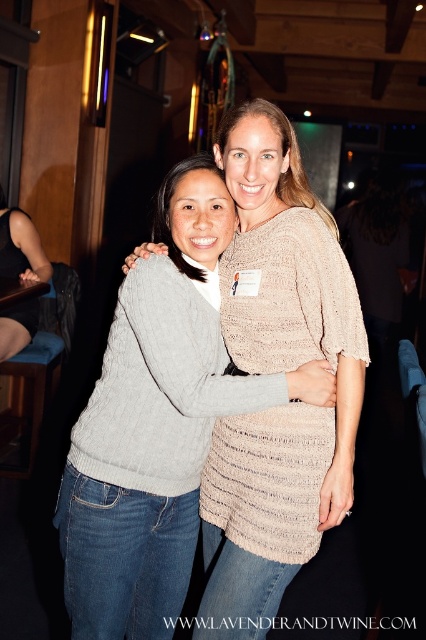
Question: Which of the following is the farthest from the observer?

Choices:
 (A) (20, 209)
 (B) (60, 529)

Answer: (A)

Question: Can you confirm if gray knitted sweater at center is positioned above matte gray sweater at lower left?

Choices:
 (A) no
 (B) yes

Answer: (A)

Question: Observing the image, what is the correct spatial positioning of gray knitted sweater at center in reference to matte gray sweater at lower left?

Choices:
 (A) below
 (B) above

Answer: (A)

Question: Which point is closer to the camera taking this photo?

Choices:
 (A) (173, 563)
 (B) (22, 323)

Answer: (A)

Question: Is gray knitted sweater at center smaller than matte gray sweater at lower left?

Choices:
 (A) yes
 (B) no

Answer: (B)